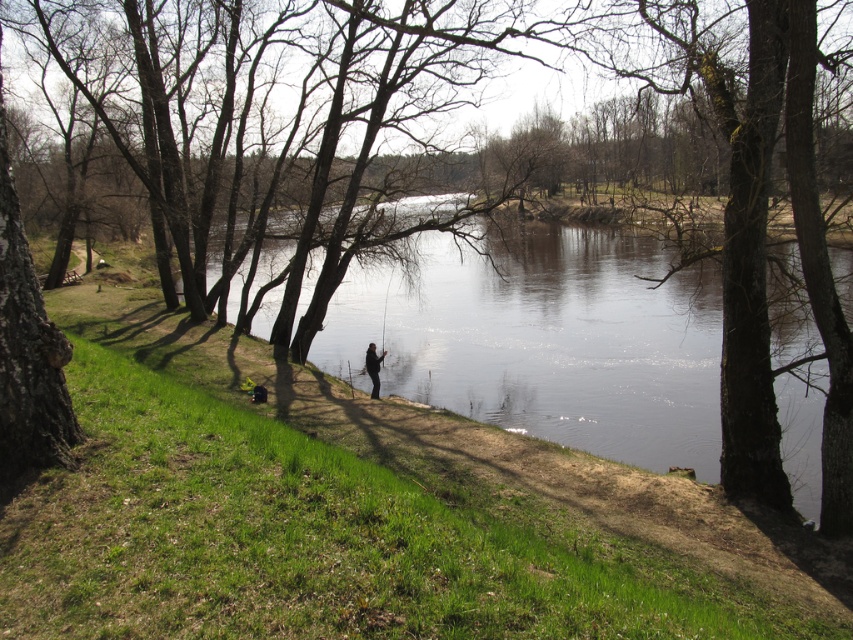
Does clear water at center lie in front of dark gray jacket at center?

Yes, it is.

Between clear water at center and dark gray jacket at center, which one has less height?

dark gray jacket at center

The width and height of the screenshot is (853, 640). What do you see at coordinates (546, 340) in the screenshot? I see `clear water at center` at bounding box center [546, 340].

Locate an element on the screen. This screenshot has width=853, height=640. clear water at center is located at coordinates (546, 340).